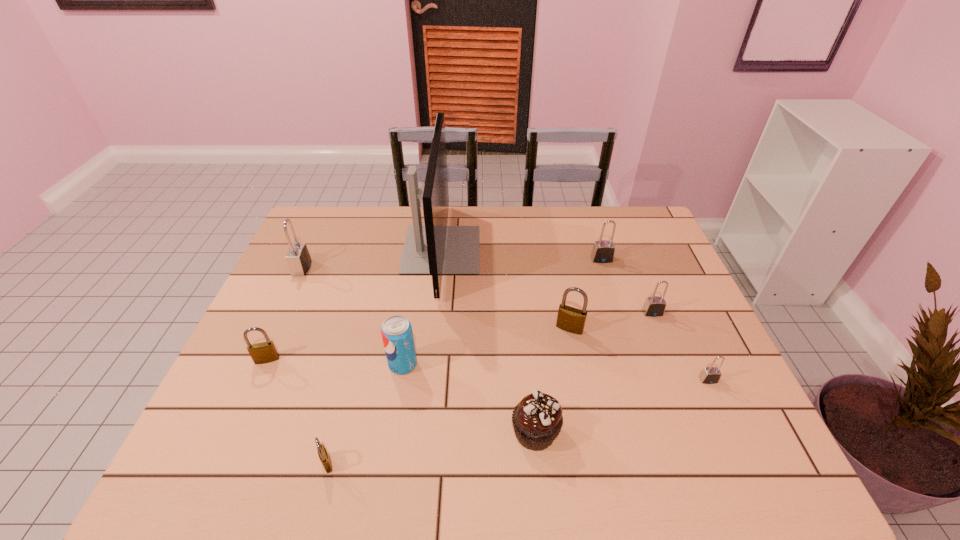
This screenshot has width=960, height=540. What are the coordinates of `free area in between the third smallest gray padlock and the eighth object from right to left` in the screenshot? It's located at (465, 361).

Locate an element on the screen. blank region between the nearest padlock and the eighth object from left to right is located at coordinates (465, 361).

The height and width of the screenshot is (540, 960). In order to click on unoccupied area between the computer monitor and the seventh nearest object in this screenshot , I will do pos(547,281).

Find the location of a particular element. This screenshot has width=960, height=540. free spot between the second nearest gray padlock and the leftmost gray padlock is located at coordinates (477, 290).

Where is `vacant space in between the second smallest brass padlock and the cupcake`? This screenshot has width=960, height=540. vacant space in between the second smallest brass padlock and the cupcake is located at coordinates (401, 396).

I want to click on unoccupied area between the ninth shortest object and the tallest object, so click(x=372, y=259).

Identify which object is located as the ninth nearest to the smallest gray padlock. Please provide its 2D coordinates. Your answer should be formatted as a tuple, i.e. [(x, y)], where the tuple contains the x and y coordinates of a point satisfying the conditions above.

[(298, 257)]

Select which object appears as the fifth closest to the tallest object. Please provide its 2D coordinates. Your answer should be formatted as a tuple, i.e. [(x, y)], where the tuple contains the x and y coordinates of a point satisfying the conditions above.

[(537, 420)]

Locate which padlock is the second closest to the computer monitor. Please provide its 2D coordinates. Your answer should be formatted as a tuple, i.e. [(x, y)], where the tuple contains the x and y coordinates of a point satisfying the conditions above.

[(298, 257)]

Identify which padlock is the sixth closest to the second padlock from right to left. Please provide its 2D coordinates. Your answer should be formatted as a tuple, i.e. [(x, y)], where the tuple contains the x and y coordinates of a point satisfying the conditions above.

[(298, 257)]